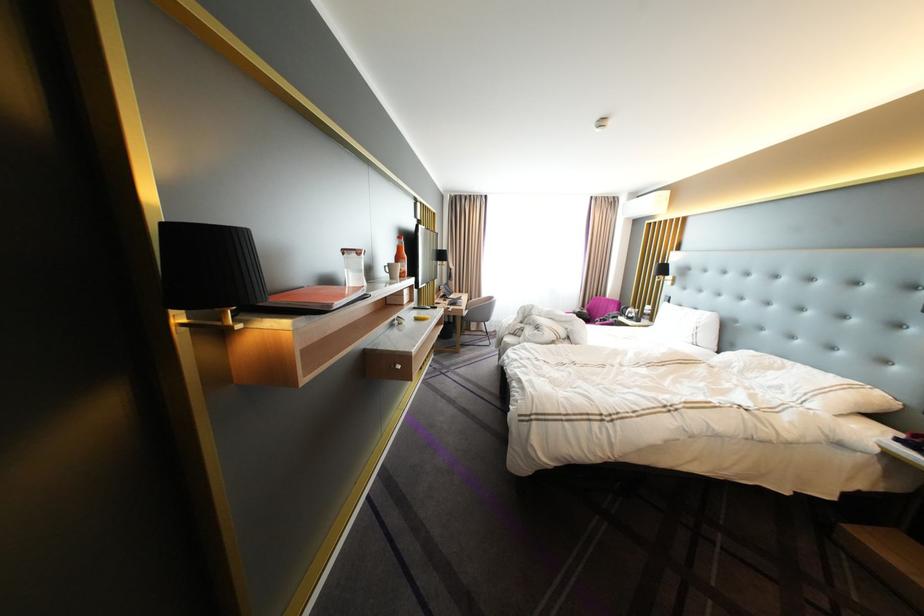
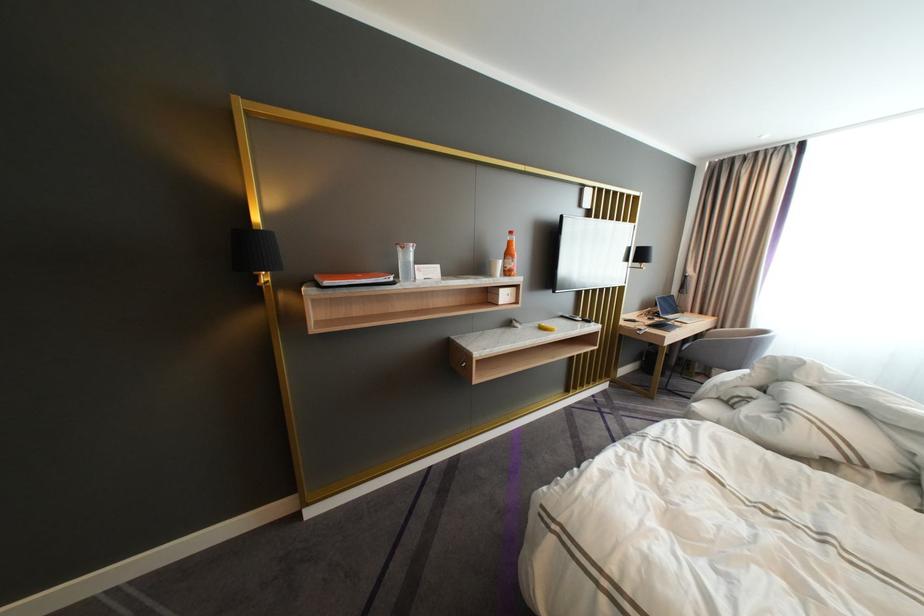
Locate, in the second image, the point that corresponds to (429,321) in the first image.

(553, 329)